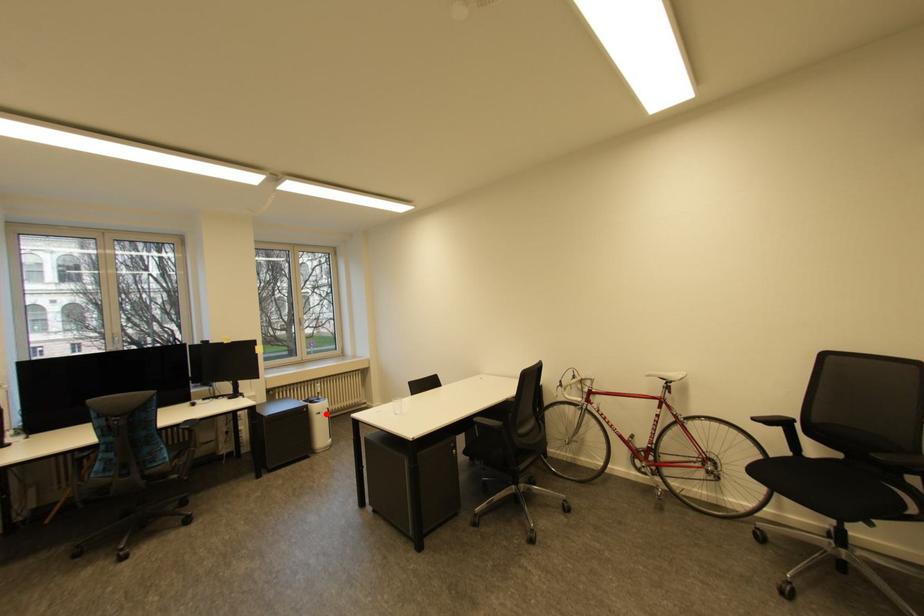
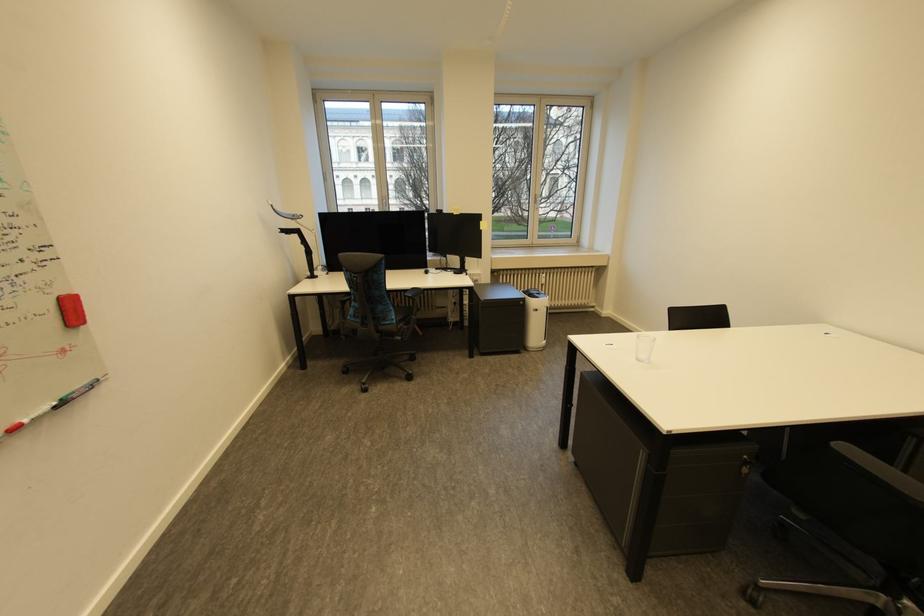
Question: I am providing you with two images of the same scene from different viewpoints. A red point is shown in image1. For the corresponding object point in image2, is it positioned nearer or farther from the camera?

Choices:
 (A) Nearer
 (B) Farther

Answer: (B)